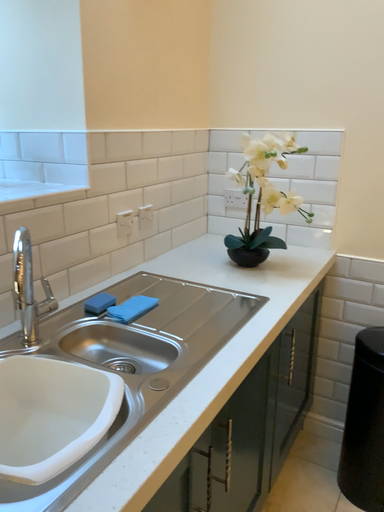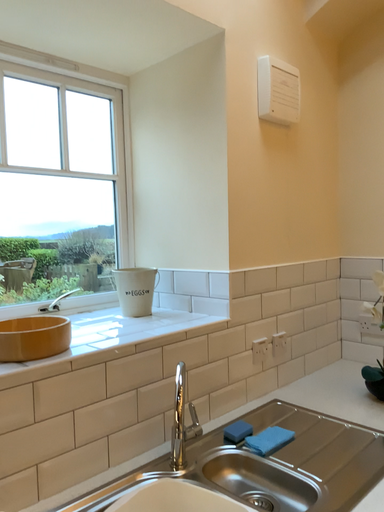
Question: Which way did the camera rotate in the video?

Choices:
 (A) rotated downward
 (B) rotated upward

Answer: (B)